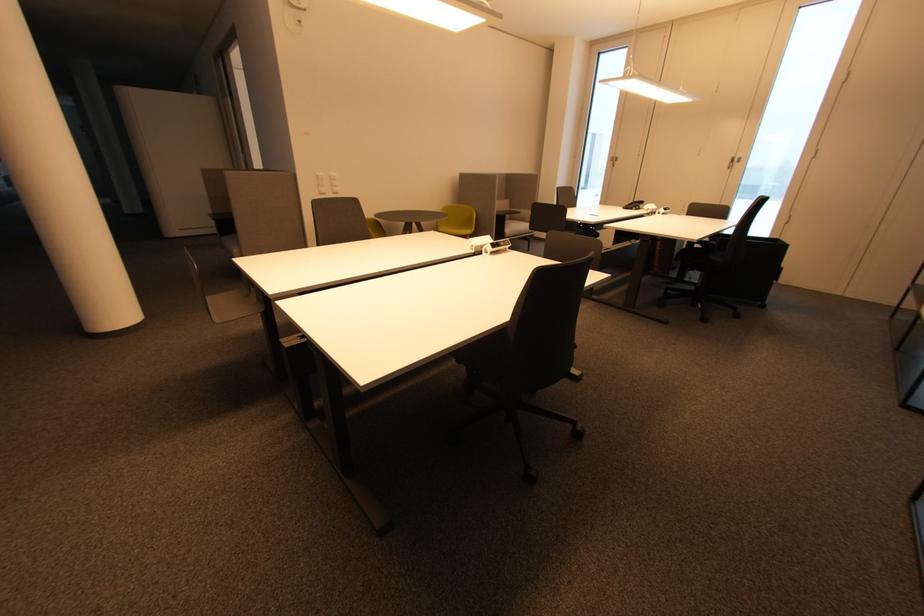
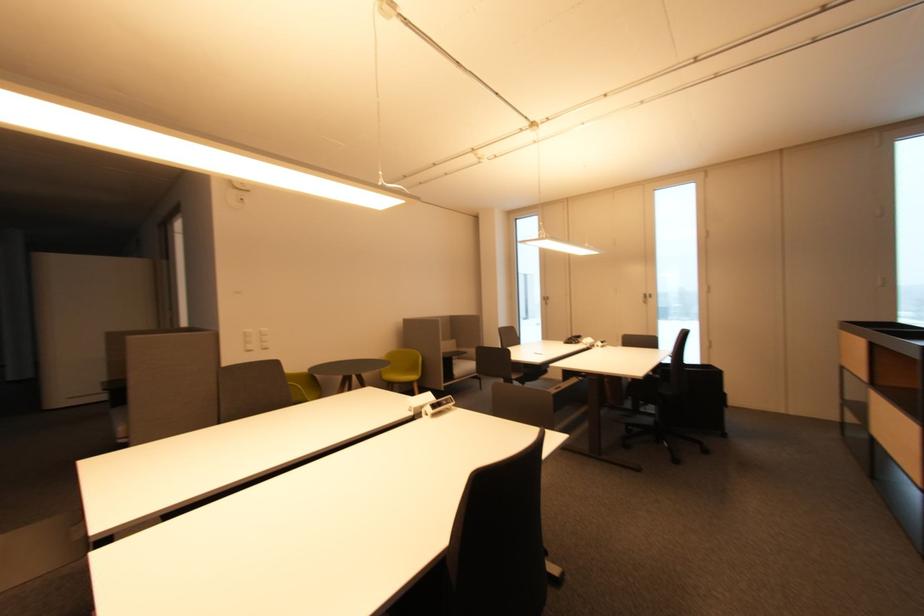
The images are taken continuously from a first-person perspective. In which direction are you moving?

The movement direction of the cameraman is right, forward.